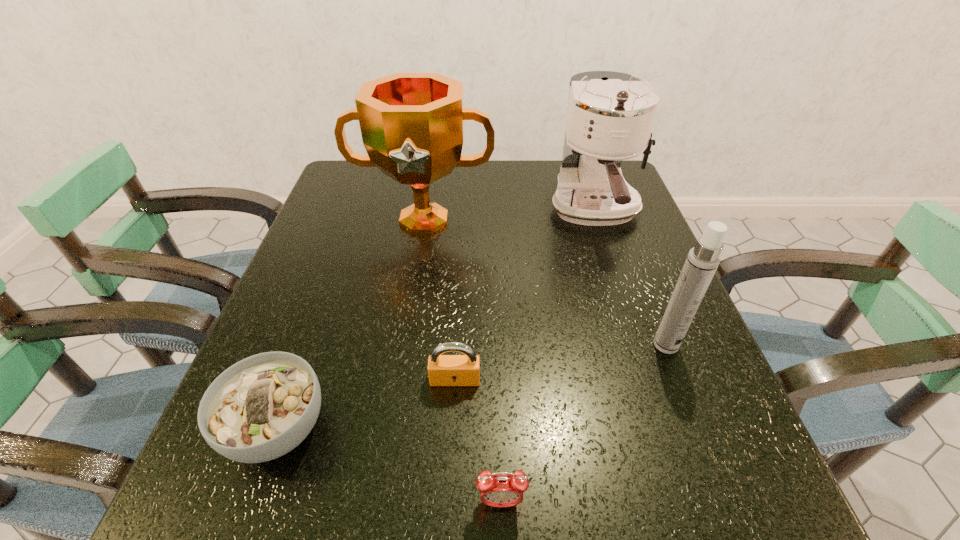
Identify the location of object present at the far left corner. Image resolution: width=960 pixels, height=540 pixels. (412, 124).

Where is `object present at the near left corner`? The width and height of the screenshot is (960, 540). object present at the near left corner is located at coordinates (262, 407).

Where is `object that is at the far right corner`? object that is at the far right corner is located at coordinates (610, 115).

What are the coordinates of `free location at the far edge` in the screenshot? It's located at (465, 200).

You are a GUI agent. You are given a task and a screenshot of the screen. Output one action in this format:
    pyautogui.click(x=<x>, y=<y>)
    Task: Click on the free space at the near edge of the desktop
    Image resolution: width=960 pixels, height=540 pixels.
    Given the screenshot: What is the action you would take?
    pyautogui.click(x=439, y=534)

In the image, there is a desktop. At what (x,y) coordinates should I click in order to perform the action: click on vacant area at the left edge. Please return your answer as a coordinate pair (x, y). Looking at the image, I should click on (309, 241).

This screenshot has width=960, height=540. In the image, there is a desktop. What are the coordinates of `vacant space at the far left corner` in the screenshot? It's located at (328, 201).

Where is `blank region between the aerosol can and the coffee maker`? The width and height of the screenshot is (960, 540). blank region between the aerosol can and the coffee maker is located at coordinates tap(631, 278).

Locate an element on the screen. vacant area that lies between the soup bowl and the coffee maker is located at coordinates (436, 319).

You are a GUI agent. You are given a task and a screenshot of the screen. Output one action in this format:
    pyautogui.click(x=<x>, y=<y>)
    Task: Click on the vacant space that's between the padlock and the award
    Image resolution: width=960 pixels, height=540 pixels.
    Given the screenshot: What is the action you would take?
    pyautogui.click(x=440, y=300)